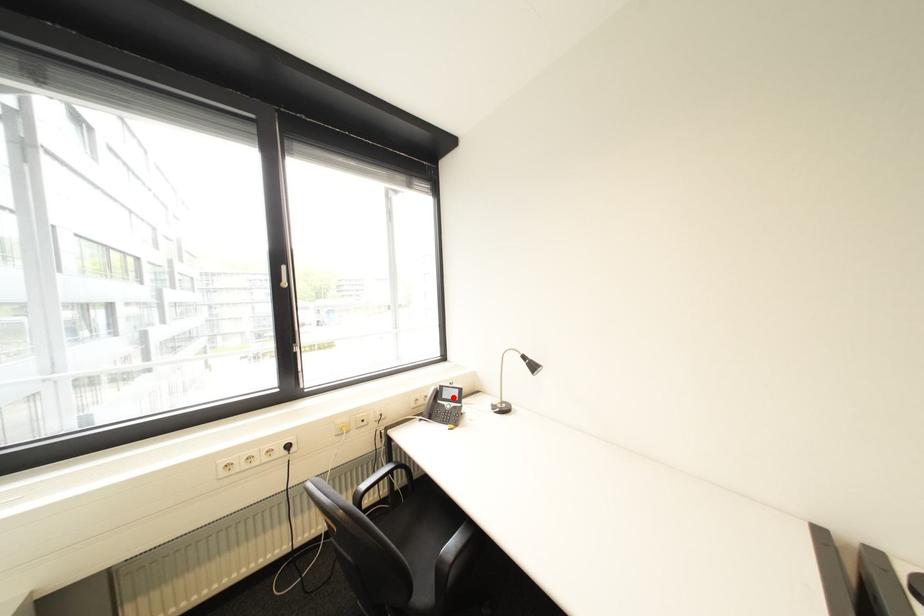
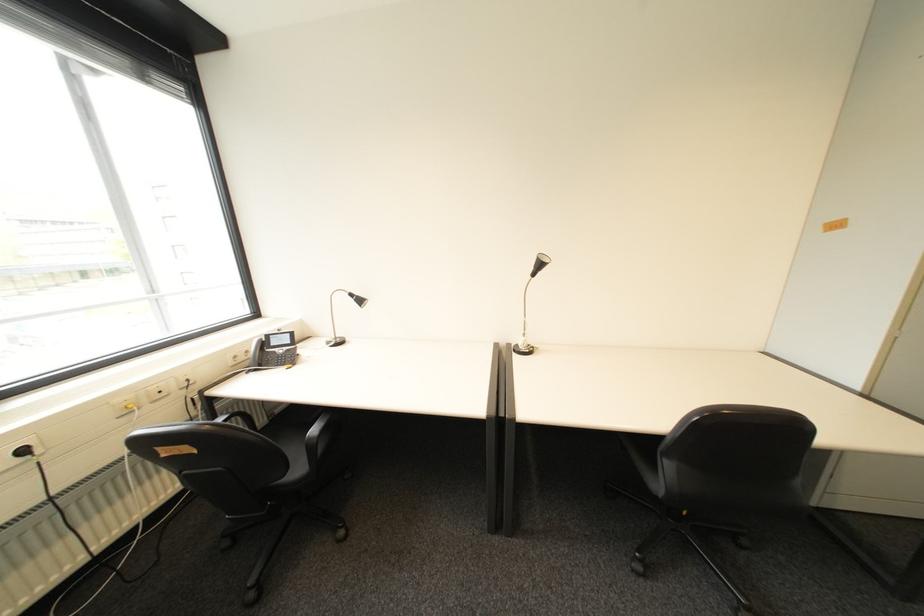
In the second image, find the point that corresponds to the highlighted location in the first image.

(283, 345)